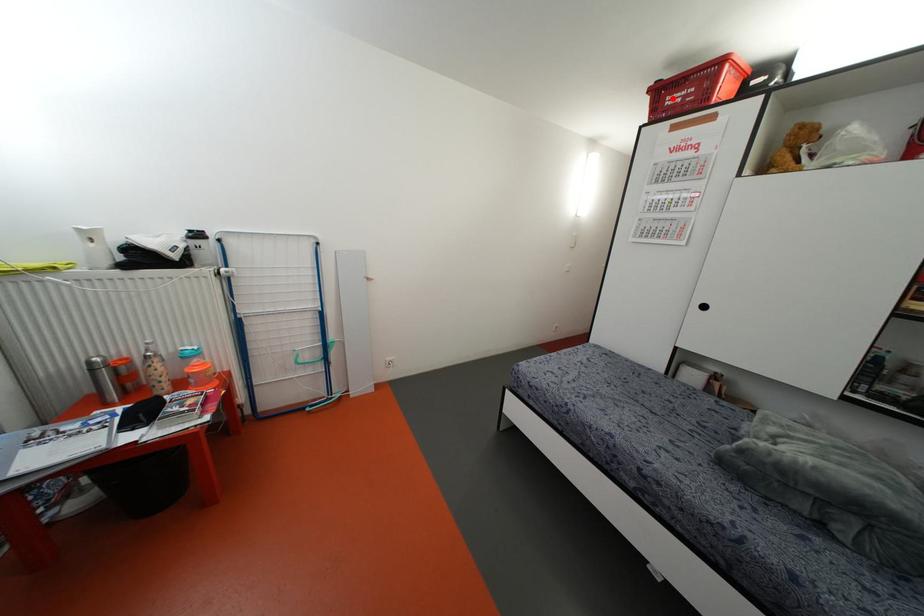
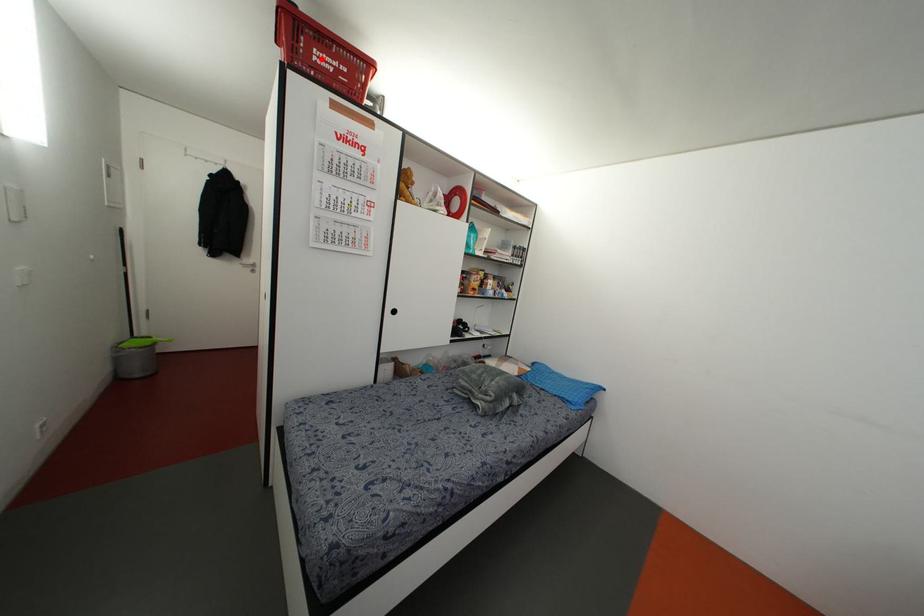
Consider the image. I am providing you with two images of the same scene from different viewpoints. A red point is marked on the first image and another point is marked on the second image. Are the points marked in image1 and image2 representing the same 3D position?

Yes